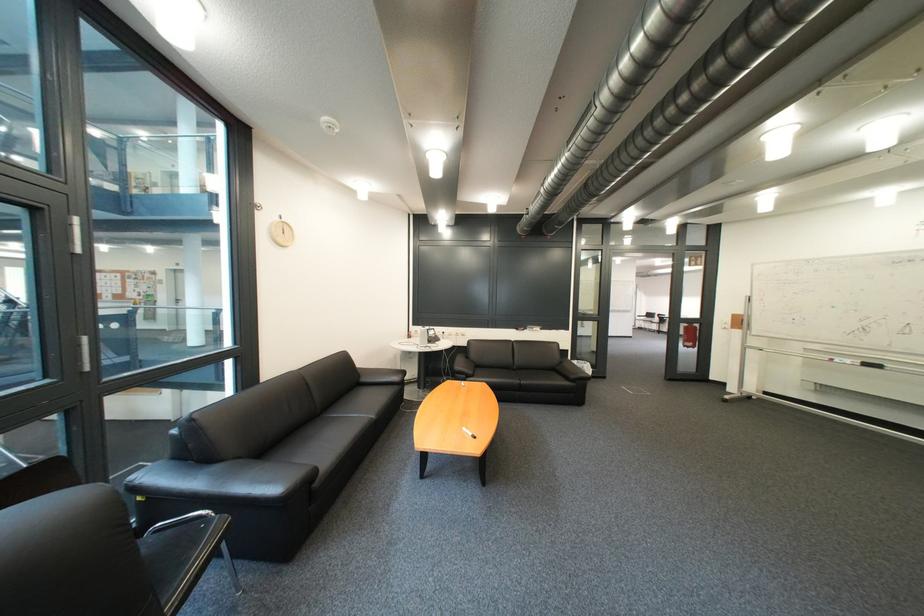
This screenshot has width=924, height=616. I want to click on telephone handset, so click(428, 334).